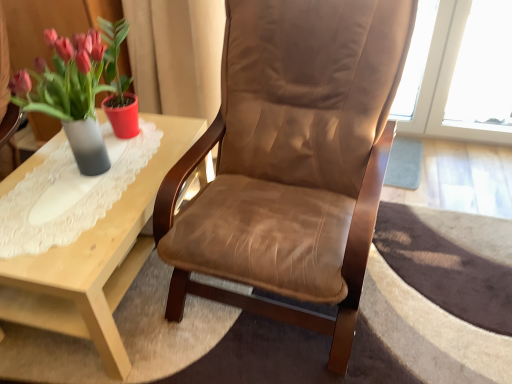
Where is `vacant space to the right of matte gray vase at left`? The image size is (512, 384). vacant space to the right of matte gray vase at left is located at coordinates pyautogui.click(x=148, y=162).